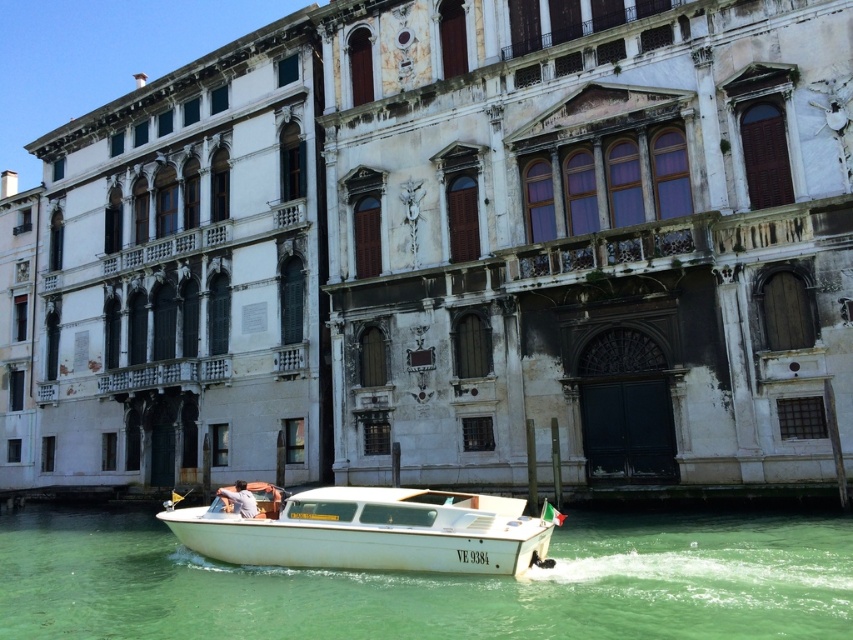
You are navigating a small motorboat with registration number VE 9384 along a canal in Venice. The boat is moving forward, and you notice the green water at boat front. Where is this green water located relative to the boat?

The green water at boat front is located at point (434, 582) relative to the boat.

You are a tourist standing on the canal bridge and see the green water at boat front and the light blue shirt at center. Which object is positioned to the right of the other?

The green water at boat front is to the right of the light blue shirt at center.